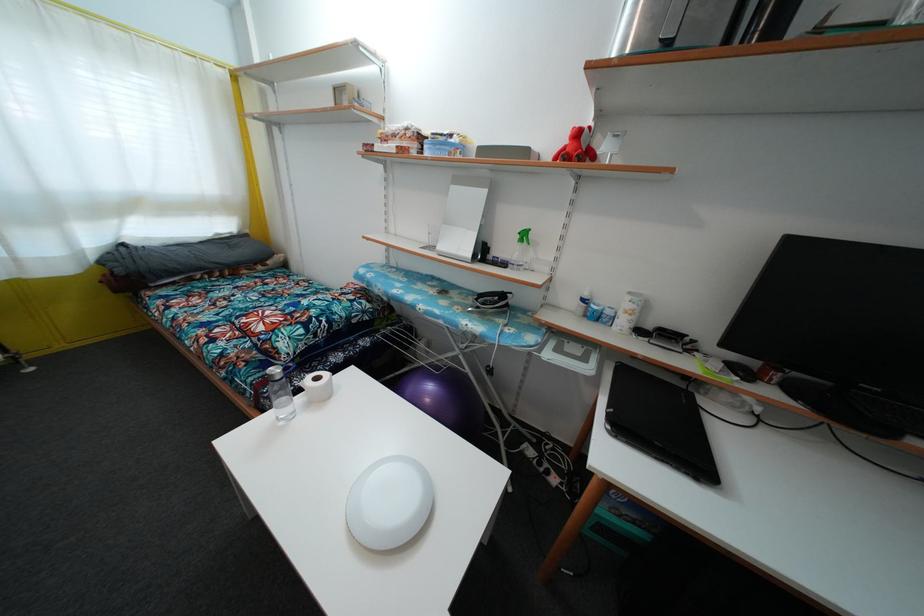
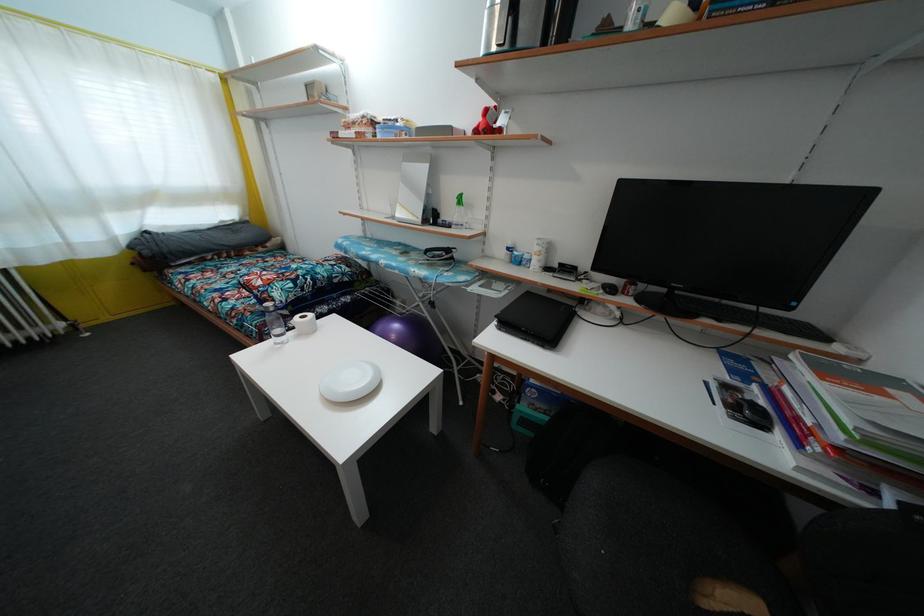
Locate, in the second image, the point that corresponds to point 321,386 in the first image.

(307, 323)